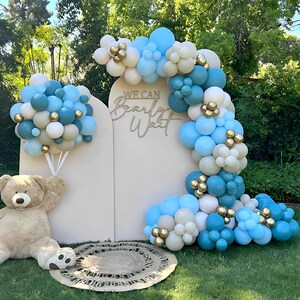
Identify the location of teddy bear. (24, 226).